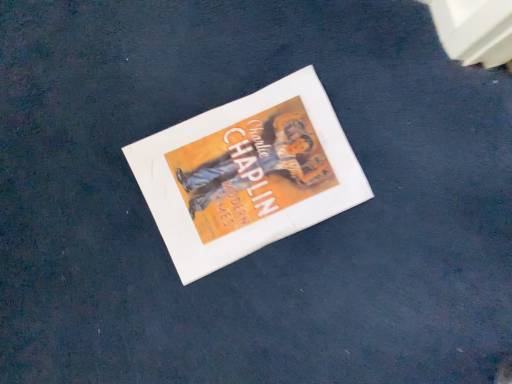
What is the approximate width of matte paper poster at center?

matte paper poster at center is 12.70 inches wide.

Image resolution: width=512 pixels, height=384 pixels. In order to click on matte paper poster at center in this screenshot , I will do `click(247, 174)`.

Image resolution: width=512 pixels, height=384 pixels. Describe the element at coordinates (247, 174) in the screenshot. I see `matte paper poster at center` at that location.

Where is `matte paper poster at center`? Image resolution: width=512 pixels, height=384 pixels. matte paper poster at center is located at coordinates (247, 174).